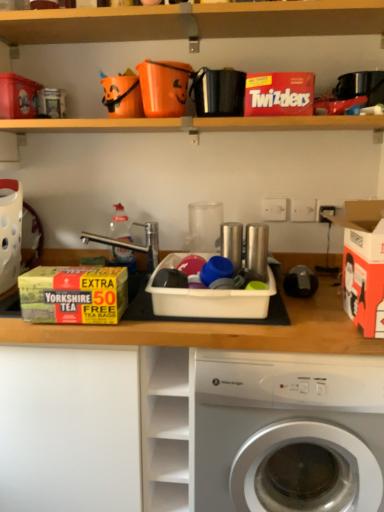
The image size is (384, 512). Describe the element at coordinates (256, 250) in the screenshot. I see `shiny metallic cup at center, acting as the second appliance starting from the top` at that location.

Locate an element on the screen. The width and height of the screenshot is (384, 512). black leather wallet at upper center, arranged as the 2th appliance when ordered from the bottom is located at coordinates (218, 92).

What is the approximate width of black leather wallet at upper center, the first appliance positioned from the left?

The width of black leather wallet at upper center, the first appliance positioned from the left, is 5.84 inches.

The width and height of the screenshot is (384, 512). In order to click on yellow cardboard box at left, the second storage box when ordered from left to right in this screenshot , I will do 74,294.

Is the position of matte cardboard box at upper left, the first storage box in the left-to-right sequence, less distant than that of white cardboard box at right, the first storage box viewed from the right?

No, it is behind white cardboard box at right, the first storage box viewed from the right.

Are matte cardboard box at upper left, marked as the fifth storage box in a right-to-left arrangement, and white cardboard box at right, the 5th storage box from the left, far apart?

matte cardboard box at upper left, marked as the fifth storage box in a right-to-left arrangement, is positioned a significant distance from white cardboard box at right, the 5th storage box from the left.

Based on the photo, is matte cardboard box at upper left, the first storage box in the left-to-right sequence, to the right of white cardboard box at right, the first storage box viewed from the right, from the viewer's perspective?

No, matte cardboard box at upper left, the first storage box in the left-to-right sequence, is not to the right of white cardboard box at right, the first storage box viewed from the right.

Who is taller, matte cardboard box at upper left, marked as the fifth storage box in a right-to-left arrangement, or white cardboard box at right, the 5th storage box from the left?

Standing taller between the two is white cardboard box at right, the 5th storage box from the left.

Could you tell me if transparent plastic bottle at center is turned towards white cardboard box at right, the 5th storage box from the left?

No, transparent plastic bottle at center is not turned towards white cardboard box at right, the 5th storage box from the left.

What's the angular difference between transparent plastic bottle at center and white cardboard box at right, the 5th storage box from the left,'s facing directions?

4.22 degrees.

From the image's perspective, does transparent plastic bottle at center appear higher than white cardboard box at right, the first storage box viewed from the right?

Yes, from the image's perspective, transparent plastic bottle at center is on top of white cardboard box at right, the first storage box viewed from the right.

How far apart are transparent plastic bottle at center and white cardboard box at right, the first storage box viewed from the right?

They are 32.71 inches apart.

Is black leather wallet at upper center, the first appliance positioned from the left, positioned behind white cardboard box at right, the first storage box viewed from the right?

Yes.

Considering the sizes of black leather wallet at upper center, the first appliance positioned from the left, and white cardboard box at right, the 5th storage box from the left, in the image, is black leather wallet at upper center, the first appliance positioned from the left, taller or shorter than white cardboard box at right, the 5th storage box from the left,?

Clearly, black leather wallet at upper center, the first appliance positioned from the left, is shorter compared to white cardboard box at right, the 5th storage box from the left.

From the image's perspective, which is above, black leather wallet at upper center, marked as the 1th appliance in a top-to-bottom arrangement, or white cardboard box at right, the first storage box viewed from the right?

black leather wallet at upper center, marked as the 1th appliance in a top-to-bottom arrangement, appears higher in the image.

Would you consider black leather wallet at upper center, arranged as the 2th appliance when ordered from the bottom, to be distant from white cardboard box at right, the first storage box viewed from the right?

They are positioned close to each other.

Does transparent plastic bottle at center have a smaller size compared to white plastic container at center, arranged as the 3th storage box when viewed from the right?

Yes, transparent plastic bottle at center is smaller than white plastic container at center, arranged as the 3th storage box when viewed from the right.

In the scene shown: Can you confirm if transparent plastic bottle at center is wider than white plastic container at center, arranged as the 3th storage box when viewed from the right?

Incorrect, the width of transparent plastic bottle at center does not surpass that of white plastic container at center, arranged as the 3th storage box when viewed from the right.

Is transparent plastic bottle at center completely or partially outside of white plastic container at center, arranged as the 3th storage box when viewed from the right?

Yes, transparent plastic bottle at center is outside of white plastic container at center, arranged as the 3th storage box when viewed from the right.

How far apart are transparent plastic bottle at center and white plastic container at center, arranged as the 3th storage box when viewed from the right?

The distance of transparent plastic bottle at center from white plastic container at center, arranged as the 3th storage box when viewed from the right, is 16.29 inches.

Is yellow cardboard box at left, which ranks as the fourth storage box in right-to-left order, inside or outside of matte cardboard box at upper left, the first storage box in the left-to-right sequence?

The correct answer is: outside.

Which object is thinner, yellow cardboard box at left, which ranks as the fourth storage box in right-to-left order, or matte cardboard box at upper left, marked as the fifth storage box in a right-to-left arrangement?

yellow cardboard box at left, which ranks as the fourth storage box in right-to-left order, is thinner.

Is point (32, 292) less distant than point (31, 112)?

Yes, point (32, 292) is closer to viewer.

Between black leather wallet at upper center, the 2th appliance in the right-to-left sequence, and transparent plastic bottle at center, which one has less height?

black leather wallet at upper center, the 2th appliance in the right-to-left sequence, is shorter.

Could you tell me if black leather wallet at upper center, marked as the 1th appliance in a top-to-bottom arrangement, is facing transparent plastic bottle at center?

No, black leather wallet at upper center, marked as the 1th appliance in a top-to-bottom arrangement, is not oriented towards transparent plastic bottle at center.

Is the surface of black leather wallet at upper center, the 2th appliance in the right-to-left sequence, in direct contact with transparent plastic bottle at center?

No.

Considering the positions of point (116, 215) and point (77, 268), is point (116, 215) closer or farther from the camera than point (77, 268)?

Clearly, point (116, 215) is more distant from the camera than point (77, 268).

Who is more distant, transparent plastic bottle at center or yellow cardboard box at left, which ranks as the fourth storage box in right-to-left order?

transparent plastic bottle at center is more distant.

Is transparent plastic bottle at center positioned with its back to yellow cardboard box at left, the second storage box when ordered from left to right?

That's not correct — transparent plastic bottle at center is not looking away from yellow cardboard box at left, the second storage box when ordered from left to right.

From the image's perspective, count 2nd storage boxs upward from the white cardboard box at right, the first storage box viewed from the right, and point to it. Please provide its 2D coordinates.

[(18, 96)]

Identify the location of storage box that is the 3rd one when counting rightward from the transparent plastic bottle at center. The image size is (384, 512). 363,264.

Looking at this image, considering their positions, is white cardboard box at right, the 5th storage box from the left, positioned further to matte cardboard box at upper left, marked as the fifth storage box in a right-to-left arrangement, than yellow cardboard box at left, the second storage box when ordered from left to right?

white cardboard box at right, the 5th storage box from the left, is positioned further to the anchor matte cardboard box at upper left, marked as the fifth storage box in a right-to-left arrangement.

Which object lies nearer to the anchor point white plastic container at center, the 3th storage box when ordered from left to right, shiny metallic cup at center, placed as the second appliance when sorted from left to right, or white cardboard box at right, the first storage box viewed from the right?

Among the two, shiny metallic cup at center, placed as the second appliance when sorted from left to right, is located nearer to white plastic container at center, the 3th storage box when ordered from left to right.

Estimate the real-world distances between objects in this image. Which object is further from red cardboard twizzlers at upper center, acting as the 4th storage box starting from the left, white plastic container at center, arranged as the 3th storage box when viewed from the right, or yellow cardboard box at left, which ranks as the fourth storage box in right-to-left order?

The object further to red cardboard twizzlers at upper center, acting as the 4th storage box starting from the left, is yellow cardboard box at left, which ranks as the fourth storage box in right-to-left order.

From the picture: Looking at the image, which one is located closer to white cardboard box at right, the 5th storage box from the left, transparent plastic bottle at center or yellow cardboard box at left, the second storage box when ordered from left to right?

yellow cardboard box at left, the second storage box when ordered from left to right.

Based on their spatial positions, is white cardboard box at right, the 5th storage box from the left, or white plastic container at center, the 3th storage box when ordered from left to right, further from yellow cardboard box at left, the second storage box when ordered from left to right?

white cardboard box at right, the 5th storage box from the left, lies further to yellow cardboard box at left, the second storage box when ordered from left to right, than the other object.

Which object lies nearer to the anchor point white glossy washing machine at lower center, black leather wallet at upper center, the 2th appliance in the right-to-left sequence, or red cardboard twizzlers at upper center, the 2th storage box positioned from the right?

Among the two, red cardboard twizzlers at upper center, the 2th storage box positioned from the right, is located nearer to white glossy washing machine at lower center.

From the image, which object appears to be farther from white plastic container at center, the 3th storage box when ordered from left to right, white glossy washing machine at lower center or red cardboard twizzlers at upper center, the 2th storage box positioned from the right?

red cardboard twizzlers at upper center, the 2th storage box positioned from the right, is positioned further to the anchor white plastic container at center, the 3th storage box when ordered from left to right.

Estimate the real-world distances between objects in this image. Which object is closer to yellow cardboard box at left, the second storage box when ordered from left to right, black leather wallet at upper center, the 2th appliance in the right-to-left sequence, or red cardboard twizzlers at upper center, the 2th storage box positioned from the right?

Based on the image, black leather wallet at upper center, the 2th appliance in the right-to-left sequence, appears to be nearer to yellow cardboard box at left, the second storage box when ordered from left to right.

Image resolution: width=384 pixels, height=512 pixels. Identify the location of appliance between matte cardboard box at upper left, marked as the fifth storage box in a right-to-left arrangement, and shiny metallic cup at center, which is the 1th appliance from bottom to top. 218,92.

Find the location of a particular element. Image resolution: width=384 pixels, height=512 pixels. bottle between black leather wallet at upper center, the first appliance positioned from the left, and shiny metallic cup at center, which is the 1th appliance from bottom to top, from top to bottom is located at coordinates (120, 225).

Where is `bottle between red cardboard twizzlers at upper center, acting as the 4th storage box starting from the left, and white plastic container at center, the 3th storage box when ordered from left to right, from top to bottom`? This screenshot has height=512, width=384. bottle between red cardboard twizzlers at upper center, acting as the 4th storage box starting from the left, and white plastic container at center, the 3th storage box when ordered from left to right, from top to bottom is located at coordinates (120, 225).

Where is `bottle between matte cardboard box at upper left, the first storage box in the left-to-right sequence, and yellow cardboard box at left, which ranks as the fourth storage box in right-to-left order, in the up-down direction`? This screenshot has width=384, height=512. bottle between matte cardboard box at upper left, the first storage box in the left-to-right sequence, and yellow cardboard box at left, which ranks as the fourth storage box in right-to-left order, in the up-down direction is located at coordinates (120, 225).